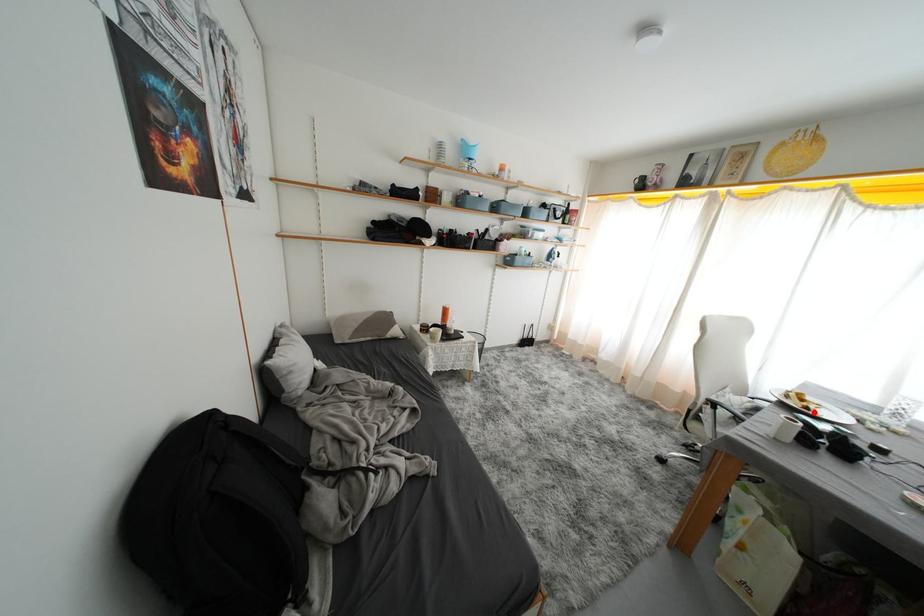
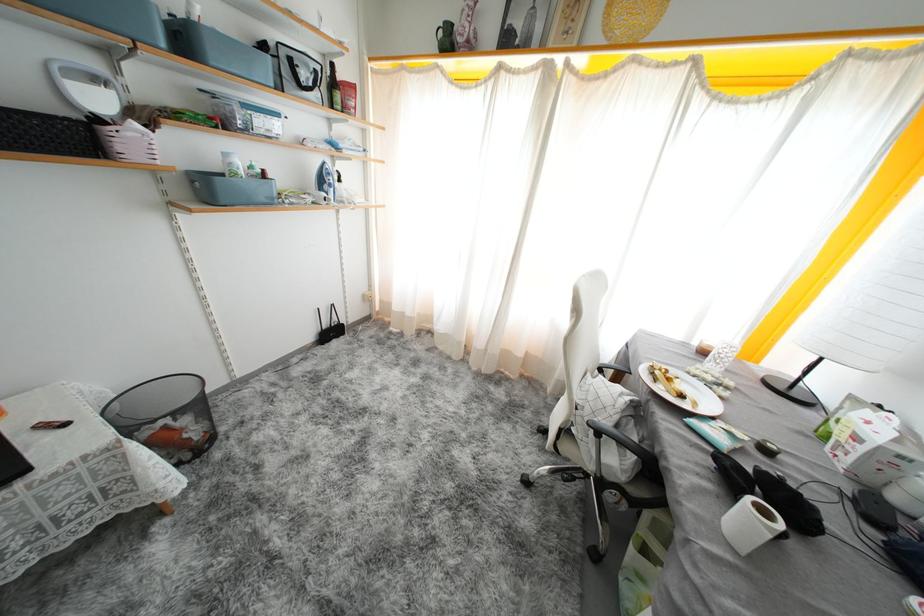
Where in the second image is the point corresponding to the highlighted location from the first image?

(687, 400)